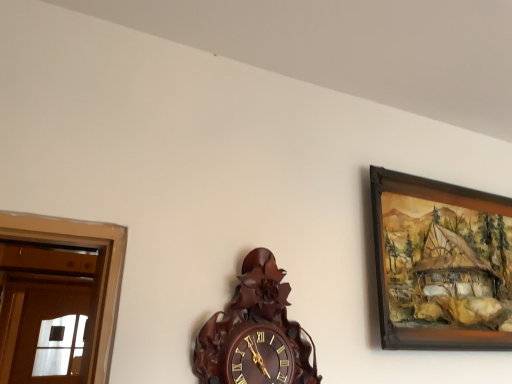
Question: In terms of size, does dark wood carved clock at center appear bigger or smaller than wooden-framed painting at upper right?

Choices:
 (A) small
 (B) big

Answer: (A)

Question: Would you say dark wood carved clock at center is inside or outside wooden-framed painting at upper right?

Choices:
 (A) outside
 (B) inside

Answer: (A)

Question: In terms of width, does dark wood carved clock at center look wider or thinner when compared to wooden-framed painting at upper right?

Choices:
 (A) wide
 (B) thin

Answer: (A)

Question: In terms of size, does wooden-framed painting at upper right appear bigger or smaller than dark wood carved clock at center?

Choices:
 (A) small
 (B) big

Answer: (B)

Question: In the image, is wooden-framed painting at upper right positioned in front of or behind dark wood carved clock at center?

Choices:
 (A) behind
 (B) front

Answer: (A)

Question: Do you think wooden-framed painting at upper right is within dark wood carved clock at center, or outside of it?

Choices:
 (A) inside
 (B) outside

Answer: (B)

Question: From a real-world perspective, is wooden-framed painting at upper right above or below dark wood carved clock at center?

Choices:
 (A) below
 (B) above

Answer: (B)